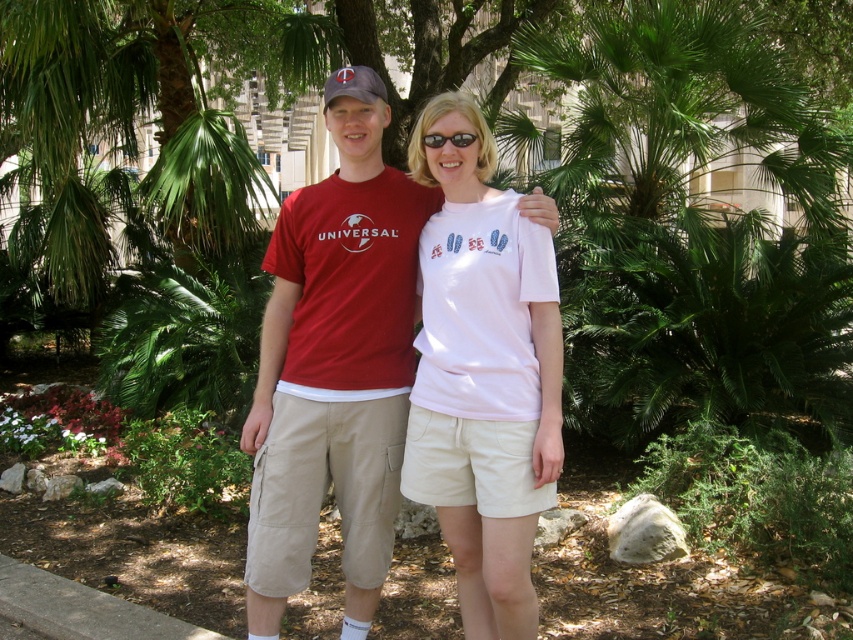
Does point (550, 376) come farther from viewer compared to point (328, 96)?

No, it is not.

This screenshot has width=853, height=640. What do you see at coordinates (483, 372) in the screenshot?
I see `white matte t-shirt at center` at bounding box center [483, 372].

Identify the location of white matte t-shirt at center. (483, 372).

How much distance is there between matte red t-shirt at center and black plastic sunglasses at center?

matte red t-shirt at center is 32.94 inches from black plastic sunglasses at center.

Between matte red t-shirt at center and black plastic sunglasses at center, which one has less height?

With less height is black plastic sunglasses at center.

Who is more forward, (300, 202) or (437, 140)?

Point (437, 140) is more forward.

Where is `matte red t-shirt at center`? matte red t-shirt at center is located at coordinates (334, 371).

Does matte red t-shirt at center have a lesser height compared to white matte t-shirt at center?

Incorrect, matte red t-shirt at center's height does not fall short of white matte t-shirt at center's.

Based on the photo, can you confirm if matte red t-shirt at center is thinner than white matte t-shirt at center?

In fact, matte red t-shirt at center might be wider than white matte t-shirt at center.

Between point (308, 493) and point (496, 448), which one is positioned behind?

The point (308, 493) is more distant.

Locate an element on the screen. matte red t-shirt at center is located at coordinates (334, 371).